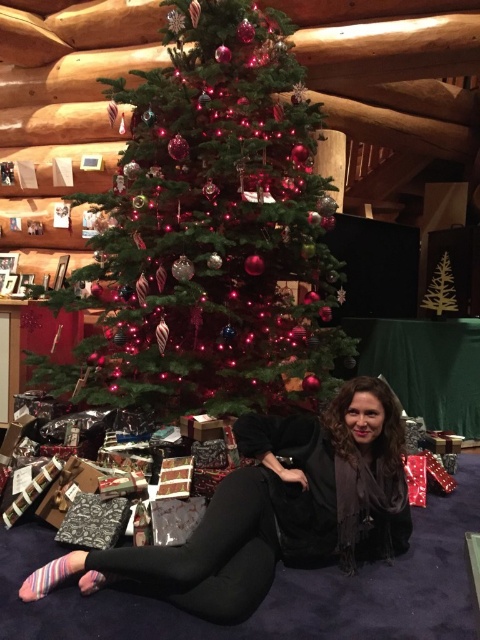
Which is in front, point (273, 296) or point (180, 593)?

Point (180, 593) is in front.

Between point (145, 333) and point (245, 570), which one is positioned behind?

The point (145, 333) is more distant.

Does point (276, 316) come farther from viewer compared to point (288, 540)?

Yes, it is behind point (288, 540).

Identify the location of shiny green christmas tree at center. The width and height of the screenshot is (480, 640). tap(210, 232).